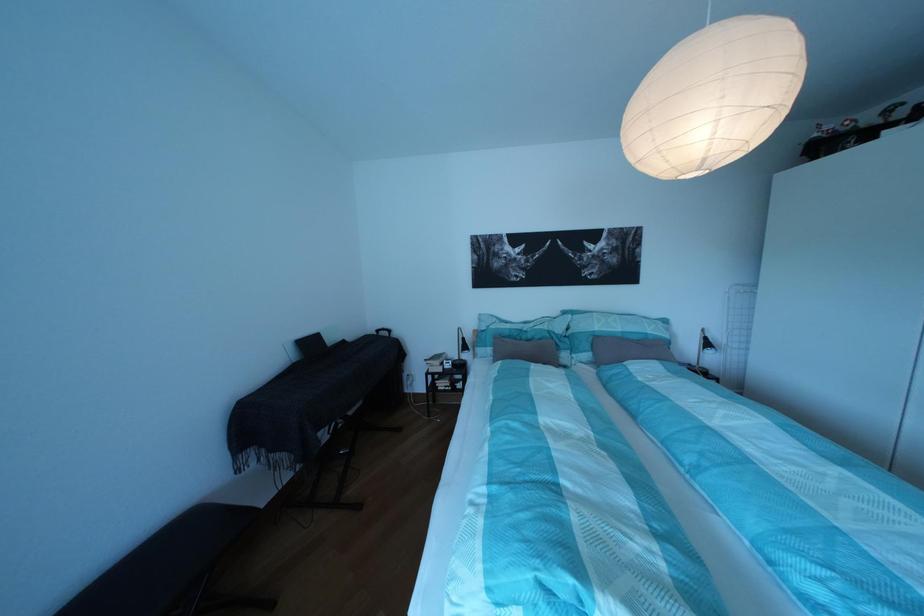
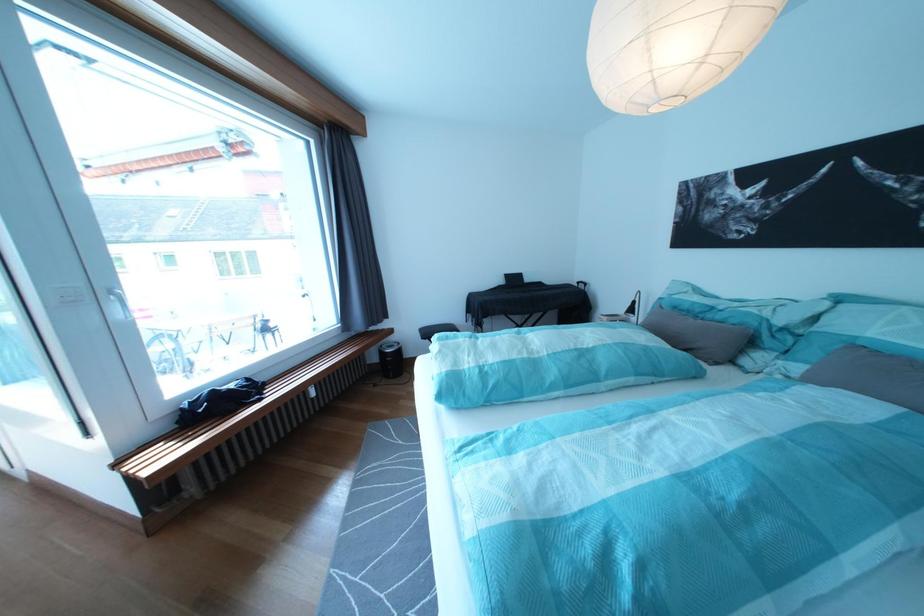
Where in the second image is the point corresponding to (675,572) from the first image?

(480, 373)